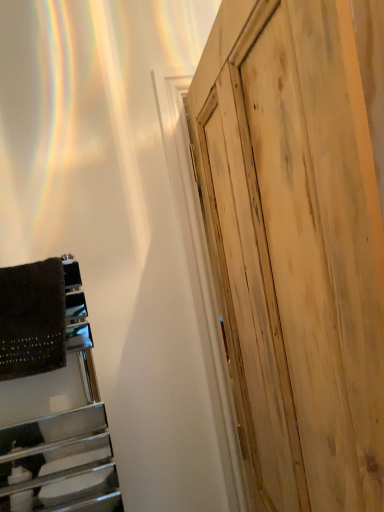
Question: From the image's perspective, is natural wood door at right under dark brown textured blanket at left?

Choices:
 (A) no
 (B) yes

Answer: (B)

Question: Does natural wood door at right have a lesser height compared to dark brown textured blanket at left?

Choices:
 (A) yes
 (B) no

Answer: (B)

Question: Does natural wood door at right have a smaller size compared to dark brown textured blanket at left?

Choices:
 (A) yes
 (B) no

Answer: (B)

Question: Is the depth of natural wood door at right less than that of dark brown textured blanket at left?

Choices:
 (A) yes
 (B) no

Answer: (A)

Question: Is natural wood door at right next to dark brown textured blanket at left and touching it?

Choices:
 (A) yes
 (B) no

Answer: (B)

Question: Is natural wood door at right positioned behind dark brown textured blanket at left?

Choices:
 (A) yes
 (B) no

Answer: (B)

Question: From a real-world perspective, is dark brown textured blanket at left over natural wood door at right?

Choices:
 (A) no
 (B) yes

Answer: (B)

Question: Does dark brown textured blanket at left have a smaller size compared to natural wood door at right?

Choices:
 (A) no
 (B) yes

Answer: (B)

Question: Can you confirm if dark brown textured blanket at left is thinner than natural wood door at right?

Choices:
 (A) no
 (B) yes

Answer: (B)

Question: Would you say dark brown textured blanket at left contains natural wood door at right?

Choices:
 (A) no
 (B) yes

Answer: (A)

Question: Is dark brown textured blanket at left aimed at natural wood door at right?

Choices:
 (A) yes
 (B) no

Answer: (B)

Question: From a real-world perspective, is dark brown textured blanket at left under natural wood door at right?

Choices:
 (A) no
 (B) yes

Answer: (A)

Question: Relative to natural wood door at right, is dark brown textured blanket at left in front or behind?

Choices:
 (A) behind
 (B) front

Answer: (A)